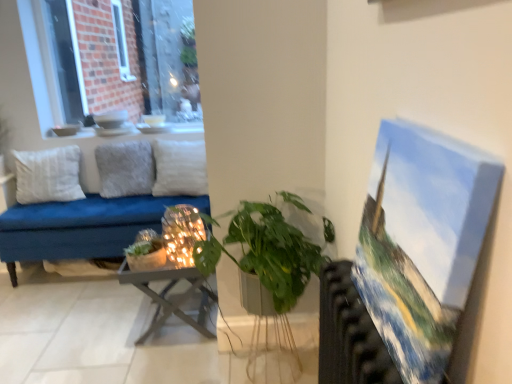
The height and width of the screenshot is (384, 512). Find the location of `vacant space in front of metallic gray table at center`. vacant space in front of metallic gray table at center is located at coordinates (169, 352).